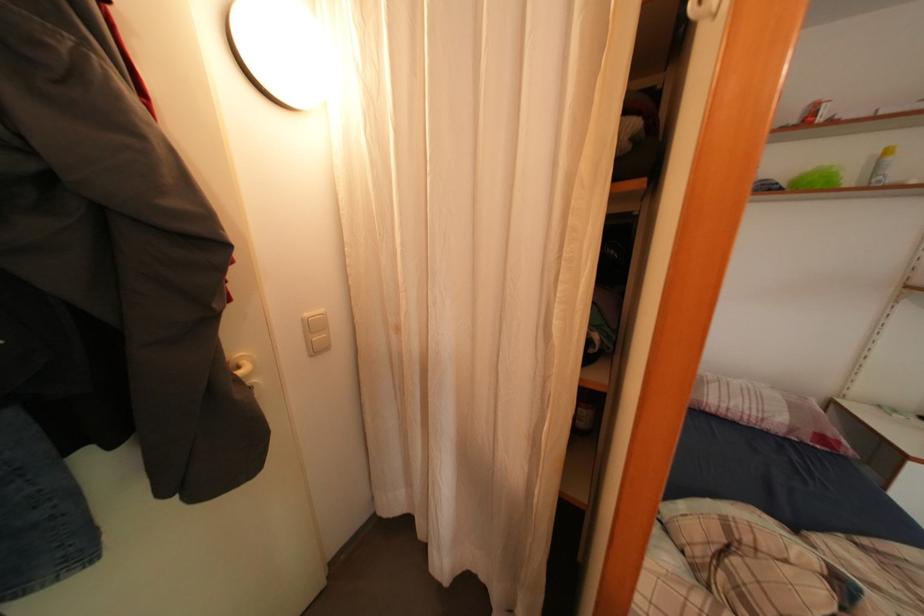
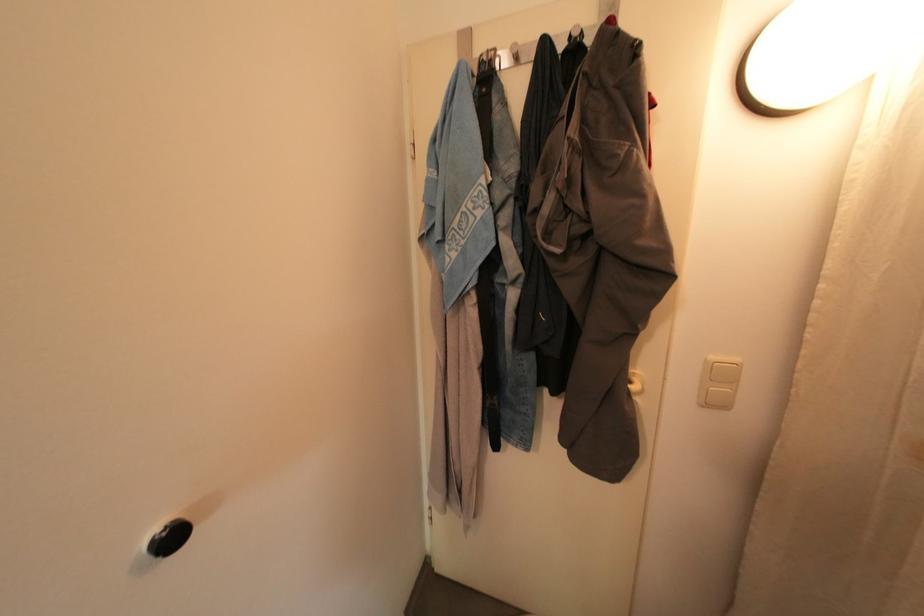
Question: The camera is either moving clockwise (left) or counter-clockwise (right) around the object. The first image is from the beginning of the video and the second image is from the end. Is the camera moving left or right when shooting the video?

Choices:
 (A) Left
 (B) Right

Answer: (B)